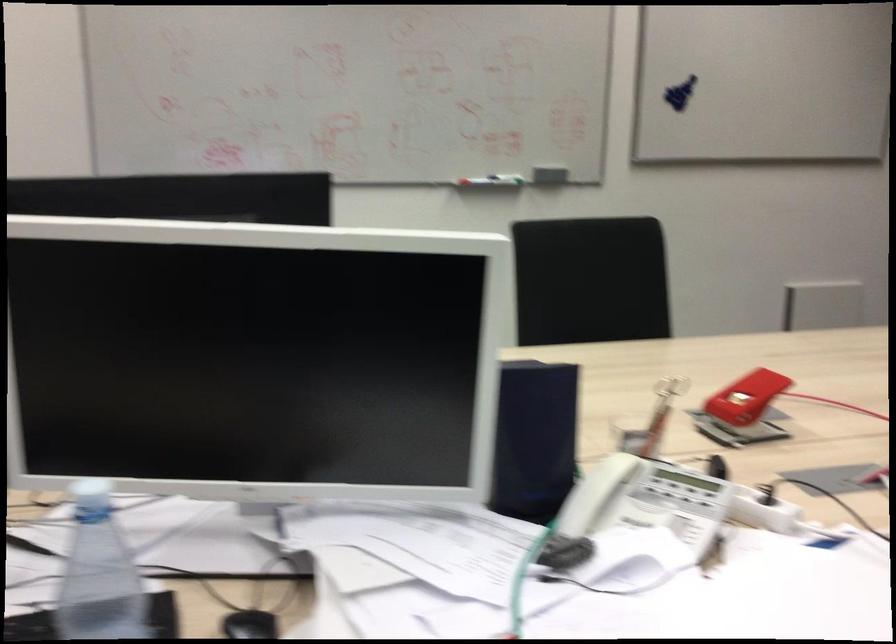
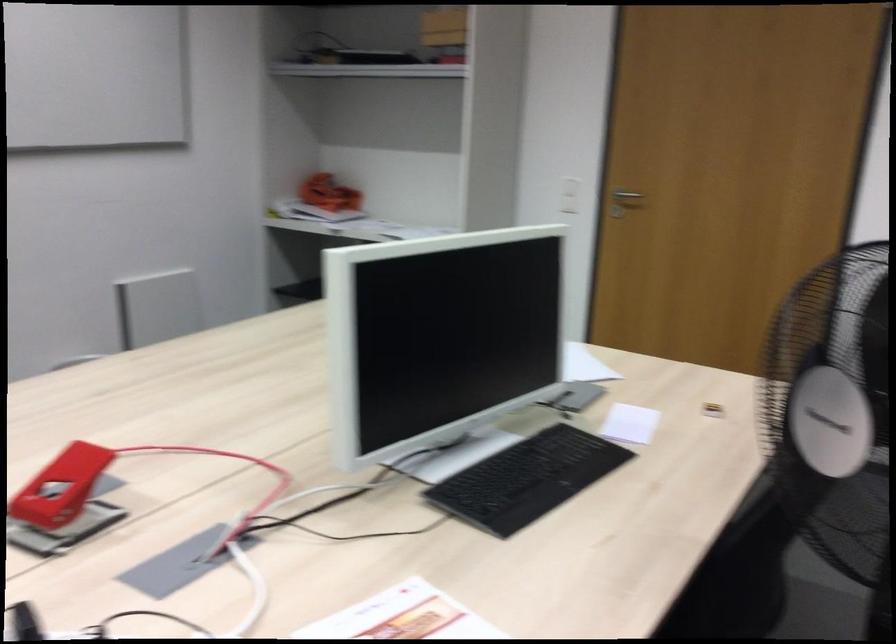
Find the pixel in the second image that matches (x=754, y=409) in the first image.

(101, 494)